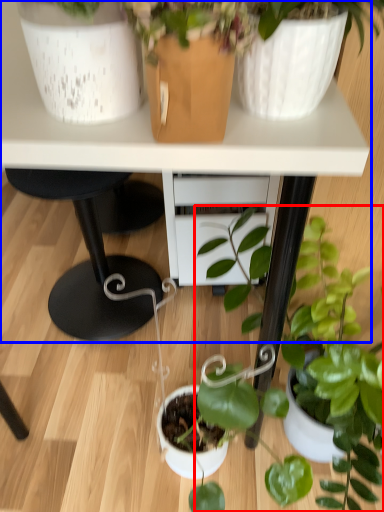
Question: Which of the following is the farthest to the observer, houseplant (highlighted by a red box) or table (highlighted by a blue box)?

Choices:
 (A) houseplant
 (B) table

Answer: (B)